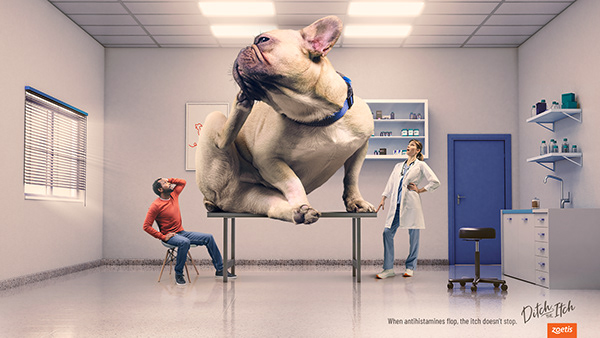
What are the coordinates of `ceiling` in the screenshot? It's located at (443, 24).